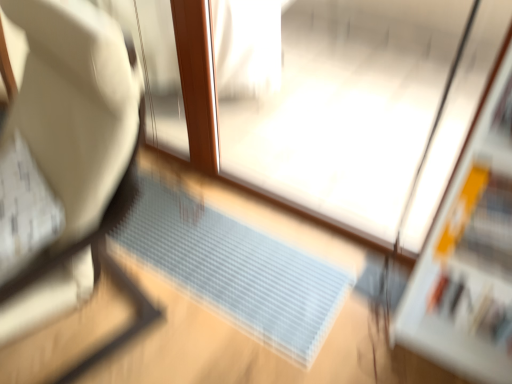
Locate an element on the screen. free space that is in between translucent plastic doormat at center and white fabric chair at left is located at coordinates tap(203, 347).